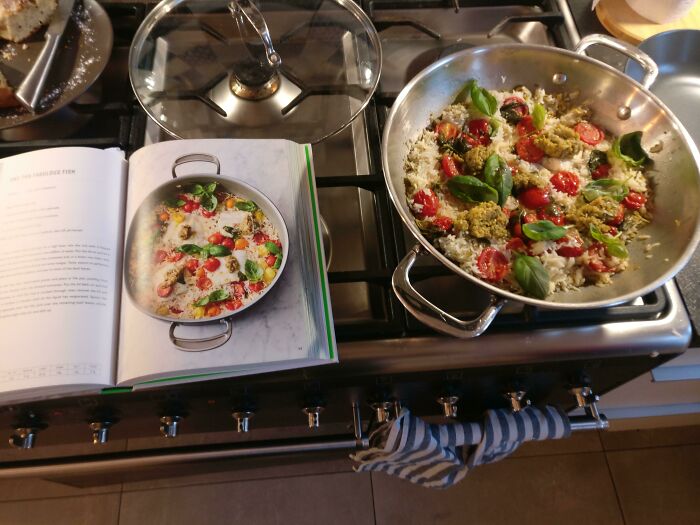
You are a GUI agent. You are given a task and a screenshot of the screen. Output one action in this format:
    pyautogui.click(x=<x>, y=<y>)
    Task: Click on the cookbook
    The height and width of the screenshot is (525, 700).
    Given the screenshot: What is the action you would take?
    pyautogui.click(x=50, y=217), pyautogui.click(x=253, y=176)